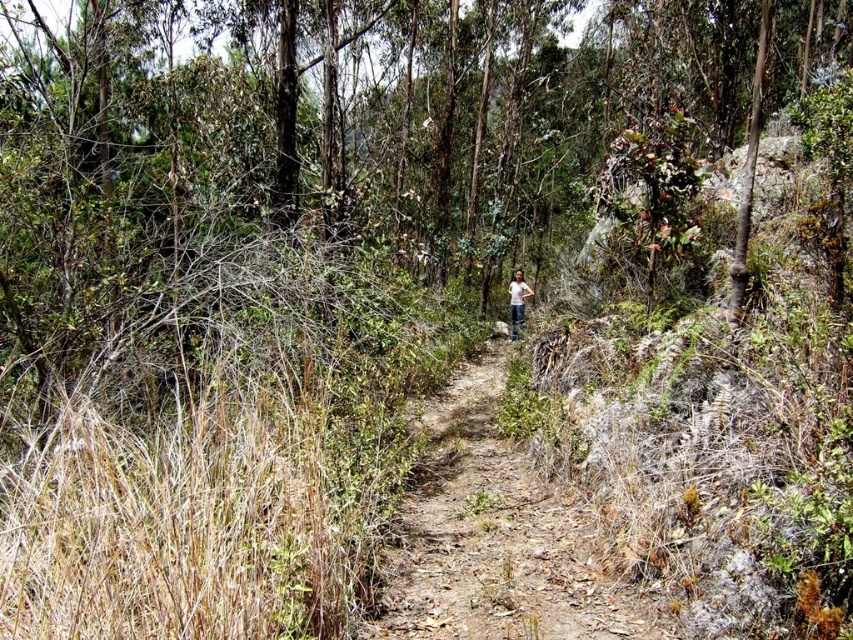
You are a hiker who wants to cross the narrow forest path. You notice dried grass at center and white cotton shirt at center. Which object is shorter?

The dried grass at center is shorter than the white cotton shirt at center.

You are a hiker with a 4 meter long hiking pole. You want to reach the dried grass at center on the forest trail. Can your hiking pole reach it?

The dried grass at center is 4.33 meters away from viewer. Since the hiking pole is only 4 meters long, it cannot reach the dried grass at center.

You are a hiker who wants to cross the forest trail. You see dried grass at center and white cotton shirt at center. How far apart are these two landmarks?

The distance between dried grass at center and white cotton shirt at center is 10.22 meters.